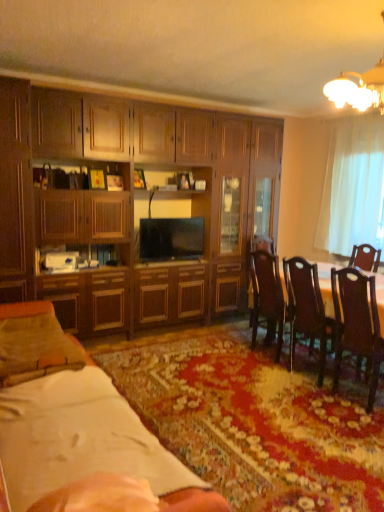
Question: Is matte wood cabinet at left, positioned as the first cabinetry in left-to-right order, located outside wooden dining table at center?

Choices:
 (A) yes
 (B) no

Answer: (A)

Question: Is matte wood cabinet at left, positioned as the first cabinetry in left-to-right order, placed right next to wooden dining table at center?

Choices:
 (A) yes
 (B) no

Answer: (B)

Question: Is matte wood cabinet at left, positioned as the first cabinetry in left-to-right order, to the left of wooden dining table at center from the viewer's perspective?

Choices:
 (A) no
 (B) yes

Answer: (B)

Question: From the image's perspective, is matte wood cabinet at left, the 2th cabinetry viewed from the right, below wooden dining table at center?

Choices:
 (A) yes
 (B) no

Answer: (B)

Question: From a real-world perspective, is matte wood cabinet at left, the 2th cabinetry viewed from the right, beneath wooden dining table at center?

Choices:
 (A) no
 (B) yes

Answer: (A)

Question: Relative to dark wood chair at right, the 1th chair viewed from the front, is matte wood cabinet at left, positioned as the first cabinetry in left-to-right order, in front or behind?

Choices:
 (A) behind
 (B) front

Answer: (A)

Question: From a real-world perspective, is matte wood cabinet at left, the 2th cabinetry viewed from the right, physically located above or below dark wood chair at right, acting as the 2th chair starting from the left?

Choices:
 (A) above
 (B) below

Answer: (A)

Question: In terms of height, does matte wood cabinet at left, the 2th cabinetry viewed from the right, look taller or shorter compared to dark wood chair at right, acting as the 2th chair starting from the left?

Choices:
 (A) tall
 (B) short

Answer: (A)

Question: Is matte wood cabinet at left, positioned as the first cabinetry in left-to-right order, wider or thinner than dark wood chair at right, acting as the 2th chair starting from the left?

Choices:
 (A) wide
 (B) thin

Answer: (A)

Question: Considering their positions, is dark wood chair at right, acting as the 2th chair starting from the left, located in front of or behind matte black tv at center?

Choices:
 (A) front
 (B) behind

Answer: (A)

Question: From the image's perspective, is dark wood chair at right, which is counted as the 1th chair, starting from the right, located above or below matte black tv at center?

Choices:
 (A) above
 (B) below

Answer: (B)

Question: Considering the positions of dark wood chair at right, which is counted as the 1th chair, starting from the right, and matte black tv at center in the image, is dark wood chair at right, which is counted as the 1th chair, starting from the right, taller or shorter than matte black tv at center?

Choices:
 (A) short
 (B) tall

Answer: (B)

Question: Based on their positions, is dark wood chair at right, which is counted as the 1th chair, starting from the right, located to the left or right of matte black tv at center?

Choices:
 (A) right
 (B) left

Answer: (A)

Question: From a real-world perspective, is matte black tv at center above or below suede-like beige pillow at lower left?

Choices:
 (A) above
 (B) below

Answer: (A)

Question: From the image's perspective, relative to suede-like beige pillow at lower left, is matte black tv at center above or below?

Choices:
 (A) below
 (B) above

Answer: (B)